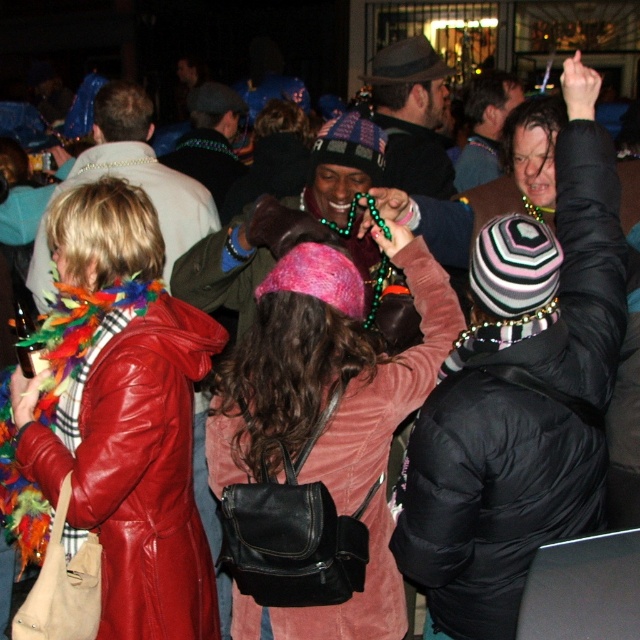
Question: Which point is farther to the camera?

Choices:
 (A) (305, 618)
 (B) (83, 280)

Answer: (B)

Question: Is leather jacket at center closer to the viewer compared to pink corduroy sweater at center?

Choices:
 (A) no
 (B) yes

Answer: (A)

Question: Can you confirm if leather jacket at center is bigger than pink corduroy sweater at center?

Choices:
 (A) yes
 (B) no

Answer: (A)

Question: Which object is closer to the camera taking this photo?

Choices:
 (A) pink corduroy sweater at center
 (B) leather jacket at center

Answer: (A)

Question: Which of the following is the farthest from the observer?

Choices:
 (A) leather jacket at center
 (B) pink corduroy sweater at center

Answer: (A)

Question: Does leather jacket at center have a greater width compared to pink corduroy sweater at center?

Choices:
 (A) yes
 (B) no

Answer: (B)